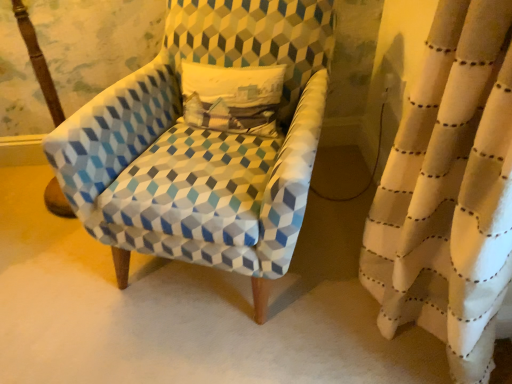
Where is `textured fabric armchair at center`? This screenshot has height=384, width=512. textured fabric armchair at center is located at coordinates (202, 145).

Image resolution: width=512 pixels, height=384 pixels. What do you see at coordinates (202, 145) in the screenshot? I see `textured fabric armchair at center` at bounding box center [202, 145].

The height and width of the screenshot is (384, 512). I want to click on textured fabric armchair at center, so click(x=202, y=145).